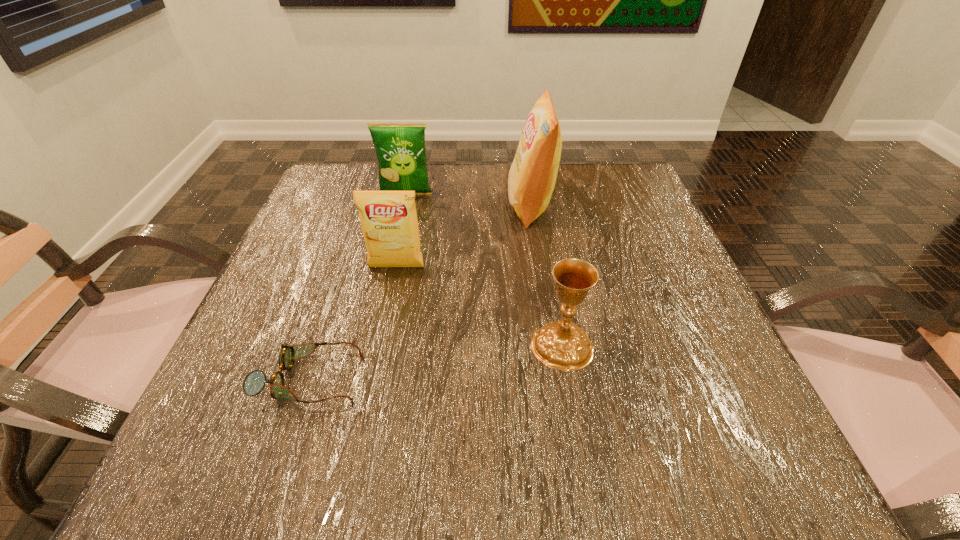
Locate an element on the screen. free space located on the front-facing side of the shortest object is located at coordinates click(555, 379).

This screenshot has width=960, height=540. I want to click on crisp (potato chip) situated at the left edge, so click(x=400, y=147).

Where is `spectacles that is at the left edge`? spectacles that is at the left edge is located at coordinates (254, 382).

Find the location of a particular element. The image size is (960, 540). object that is at the far left corner is located at coordinates (400, 147).

I want to click on free space at the far edge of the desktop, so click(x=475, y=167).

Find the location of `free spot at the near edge of the desktop`. free spot at the near edge of the desktop is located at coordinates (581, 445).

In order to click on vacant space at the left edge in this screenshot , I will do `click(238, 353)`.

The height and width of the screenshot is (540, 960). Identify the location of blank area at the right edge. coord(632,316).

Identify the location of vacant space at the far right corner of the desktop. Image resolution: width=960 pixels, height=540 pixels. (591, 211).

Image resolution: width=960 pixels, height=540 pixels. I want to click on vacant area that lies between the chalice and the nearest crisp (potato chip), so click(x=479, y=306).